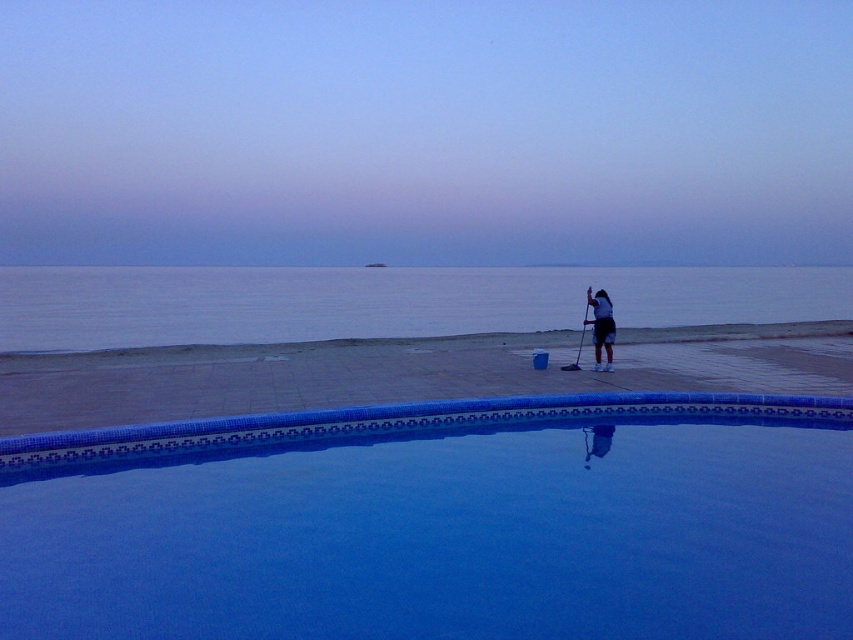
Question: Based on their relative distances, which object is farther from the blue smooth water at center?

Choices:
 (A) dark blue fabric shorts at right
 (B) smooth concrete beach at center
 (C) blue glossy pool at center

Answer: (C)

Question: Is blue glossy pool at center to the right of smooth concrete beach at center from the viewer's perspective?

Choices:
 (A) no
 (B) yes

Answer: (A)

Question: Among these points, which one is farthest from the camera?

Choices:
 (A) (540, 592)
 (B) (579, 372)
 (C) (612, 323)
 (D) (529, 316)

Answer: (D)

Question: Which object appears closest to the camera in this image?

Choices:
 (A) smooth concrete beach at center
 (B) blue glossy pool at center

Answer: (A)

Question: Can you confirm if blue glossy pool at center is bigger than blue smooth water at center?

Choices:
 (A) yes
 (B) no

Answer: (B)

Question: Considering the relative positions of blue glossy pool at center and dark blue fabric shorts at right in the image provided, where is blue glossy pool at center located with respect to dark blue fabric shorts at right?

Choices:
 (A) above
 (B) below

Answer: (B)